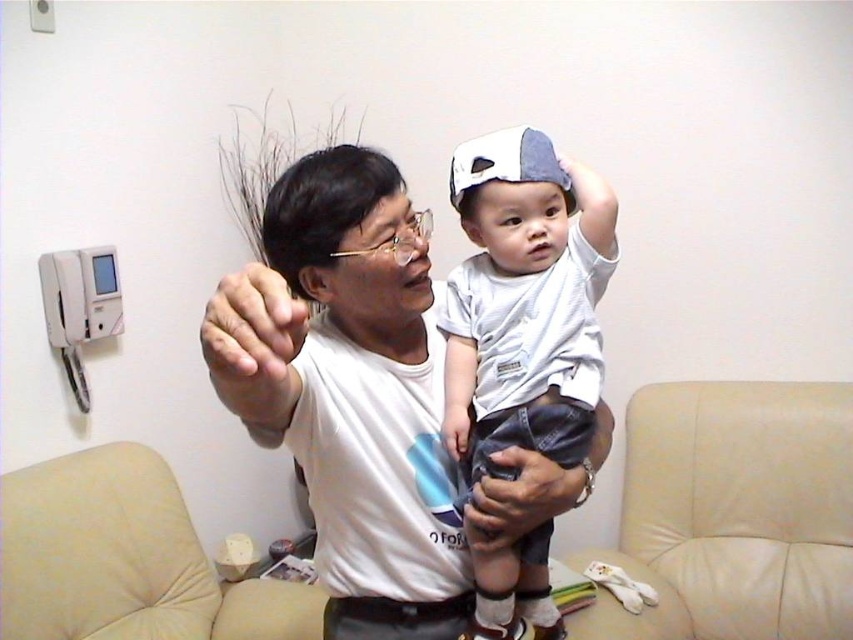
Is beige leather couch at lower center to the left of white matte hand at center from the viewer's perspective?

In fact, beige leather couch at lower center is to the right of white matte hand at center.

Who is more forward, (283, 582) or (287, 400)?

Positioned in front is point (287, 400).

Identify the location of beige leather couch at lower center. (733, 513).

Can you confirm if white matte hand at center is positioned to the left of black leather pants at lower center?

Indeed, white matte hand at center is positioned on the left side of black leather pants at lower center.

Which is above, white matte hand at center or black leather pants at lower center?

white matte hand at center

Is point (294, 390) farther from camera compared to point (453, 630)?

That is False.

Identify the location of white matte hand at center. (254, 346).

Is white cotton shirt at center taller than white matte hand at center?

Yes.

Can you confirm if white cotton shirt at center is smaller than white matte hand at center?

Actually, white cotton shirt at center might be larger than white matte hand at center.

Consider the image. Who is more distant from viewer, (492, 198) or (219, 317)?

The point (492, 198) is more distant.

Identify the location of white cotton shirt at center. This screenshot has width=853, height=640. (524, 301).